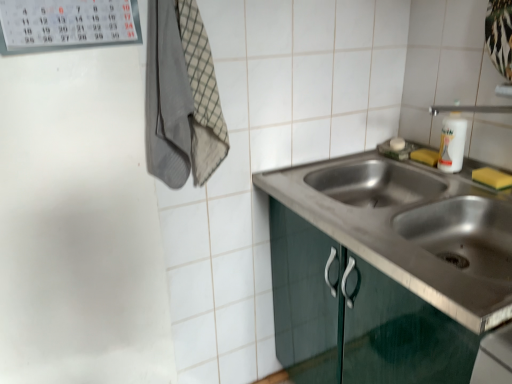
Question: Is yellow sponge at sink right, placed as the first soap when sorted from left to right, bigger or smaller than stainless steel sink at center?

Choices:
 (A) small
 (B) big

Answer: (A)

Question: Is yellow sponge at sink right, arranged as the 2th soap when ordered from the bottom, inside the boundaries of stainless steel sink at center, or outside?

Choices:
 (A) inside
 (B) outside

Answer: (A)

Question: Which of these objects is positioned closest to the yellow sponge at right, arranged as the first soap when viewed from the right?

Choices:
 (A) stainless steel sink at lower right
 (B) yellow sponge at sink right, arranged as the first soap when viewed from the top
 (C) stainless steel sink at center
 (D) gray cotton towel at upper left
 (E) white glossy bottle at upper right

Answer: (E)

Question: Estimate the real-world distances between objects in this image. Which object is farther from the gray cotton towel at upper left?

Choices:
 (A) white glossy bottle at upper right
 (B) stainless steel sink at lower right
 (C) yellow sponge at sink right, the second soap positioned from the right
 (D) stainless steel sink at center
 (E) yellow sponge at right, arranged as the first soap when ordered from the bottom

Answer: (E)